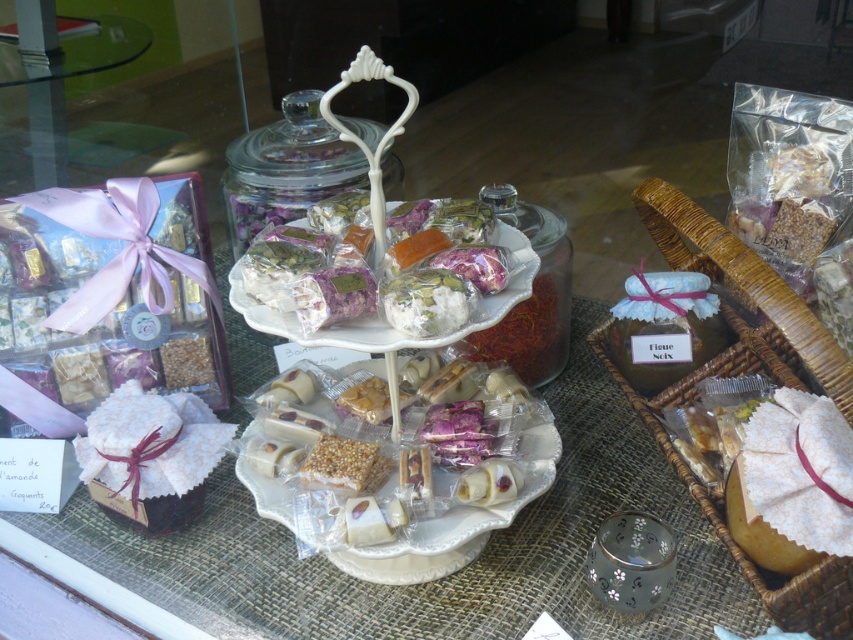
Does point (317, 298) come closer to viewer compared to point (541, 232)?

Yes, point (317, 298) is closer to viewer.

At what (x,y) coordinates should I click in order to perform the action: click on translucent plastic wrapped candies at center. Please return your answer as a coordinate pair (x, y). Looking at the image, I should click on (335, 250).

Which is behind, point (456, 241) or point (519, 225)?

The point (519, 225) is behind.

You are a GUI agent. You are given a task and a screenshot of the screen. Output one action in this format:
    pyautogui.click(x=<x>, y=<y>)
    Task: Click on the translucent plastic wrapped candies at center
    
    Given the screenshot: What is the action you would take?
    pyautogui.click(x=335, y=250)

Does woven brown basket at right appear on the left side of matte brown jar at center?

Incorrect, woven brown basket at right is not on the left side of matte brown jar at center.

Is woven brown basket at right closer to camera compared to matte brown jar at center?

Yes, woven brown basket at right is closer to the viewer.

Is point (787, 628) positioned after point (728, 332)?

No, (787, 628) is closer to viewer.

Where is `woven brown basket at right`? Image resolution: width=853 pixels, height=640 pixels. woven brown basket at right is located at coordinates (744, 372).

Which is above, translucent plastic wrapped candies at center or transparent glass jar at center?

transparent glass jar at center is above.

Can you confirm if translucent plastic wrapped candies at center is shorter than transparent glass jar at center?

Yes, translucent plastic wrapped candies at center is shorter than transparent glass jar at center.

Identify the location of translucent plastic wrapped candies at center. (335, 250).